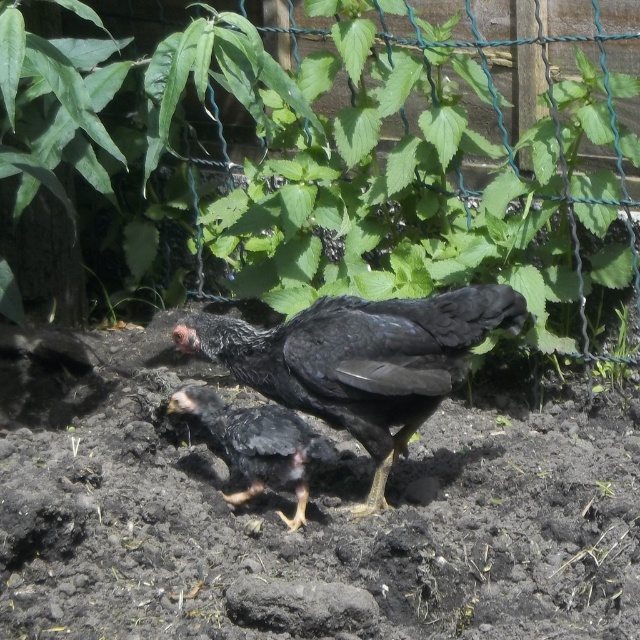
Is shiny black chicken at center positioned in front of black matte chicken at center?

Yes, it is.

Between shiny black chicken at center and black matte chicken at center, which one is positioned higher?

shiny black chicken at center is above.

Where is `shiny black chicken at center`? Image resolution: width=640 pixels, height=640 pixels. shiny black chicken at center is located at coordinates 360,360.

Does green leafy plant at center appear on the left side of black matte chicken at center?

Incorrect, green leafy plant at center is not on the left side of black matte chicken at center.

Does point (628, 243) come closer to viewer compared to point (276, 413)?

No, (628, 243) is behind (276, 413).

Measure the distance between point (x=611, y=136) and camera.

Point (x=611, y=136) and camera are 10.02 feet apart.

Identify the location of green leafy plant at center. This screenshot has width=640, height=640. (330, 156).

Does green leafy plant at center have a larger size compared to shiny black chicken at center?

Yes.

Measure the distance between point (92, 145) and camera.

Point (92, 145) is 3.44 meters from camera.

Image resolution: width=640 pixels, height=640 pixels. What do you see at coordinates (330, 156) in the screenshot? I see `green leafy plant at center` at bounding box center [330, 156].

Locate an element on the screen. green leafy plant at center is located at coordinates (330, 156).